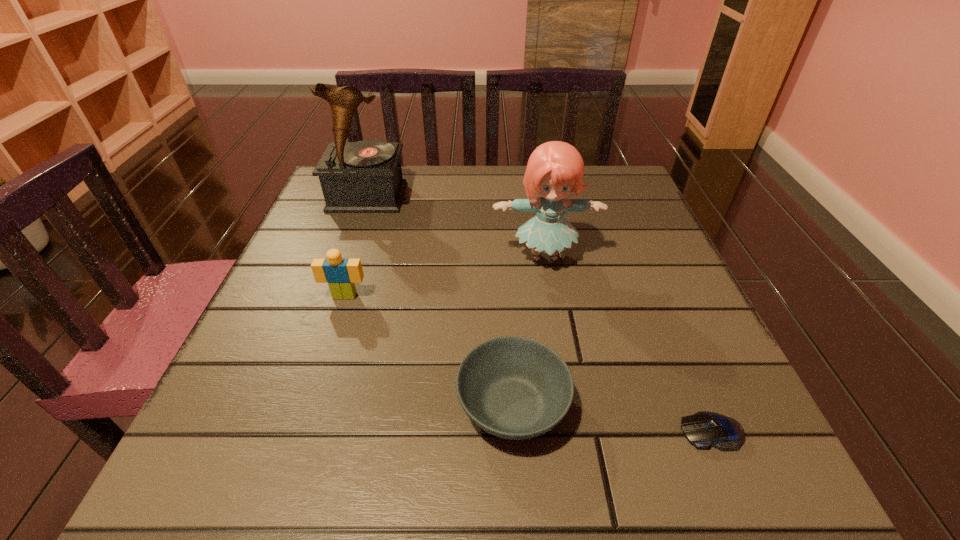
Locate an element on the screen. The image size is (960, 540). vacant space located 0.340m on the face of the third nearest object is located at coordinates (282, 488).

Find the location of `vacant space located on the back of the soup bowl`. vacant space located on the back of the soup bowl is located at coordinates (503, 247).

Locate an element on the screen. The width and height of the screenshot is (960, 540). vacant region located on the button side of the computer mouse is located at coordinates pyautogui.click(x=531, y=432).

Identify the location of vacant space located on the button side of the computer mouse. (623, 432).

Locate an element on the screen. This screenshot has height=540, width=960. vacant space located 0.120m on the button side of the computer mouse is located at coordinates (594, 432).

This screenshot has height=540, width=960. I want to click on object at the far edge, so click(365, 176).

Locate an element on the screen. Image resolution: width=960 pixels, height=540 pixels. soup bowl that is at the near edge is located at coordinates (513, 387).

Locate an element on the screen. The height and width of the screenshot is (540, 960). computer mouse situated at the near edge is located at coordinates click(x=703, y=429).

I want to click on phonograph_record that is at the left edge, so click(365, 176).

At what (x,y) coordinates should I click in order to perform the action: click on Lego positioned at the left edge. Please return your answer as a coordinate pair (x, y). The width and height of the screenshot is (960, 540). Looking at the image, I should click on 341,274.